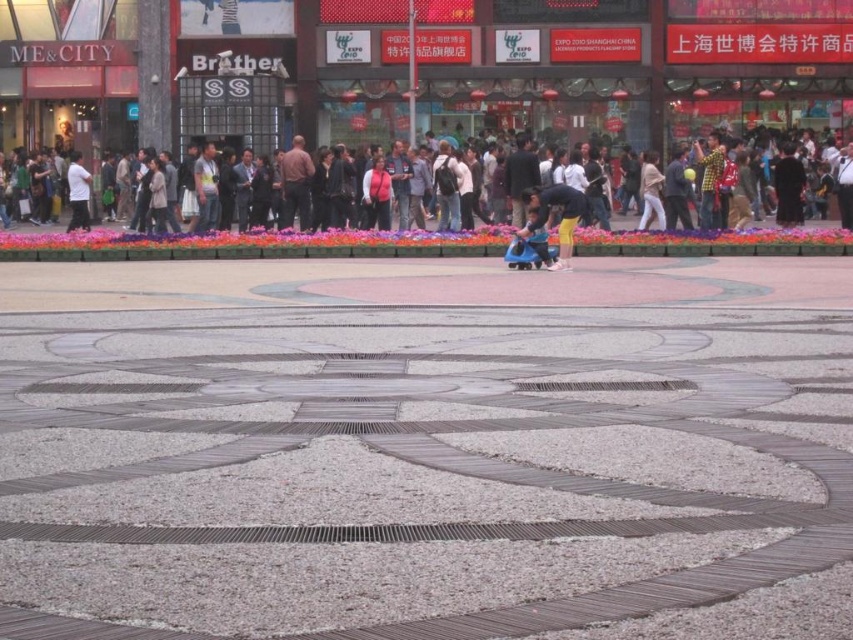
Question: Estimate the real-world distances between objects in this image. Which object is closer to the white matte shirt at left?

Choices:
 (A) matte glass mall at upper center
 (B) white gravel at center
 (C) black matte person at right
 (D) yellow fabric pants at center

Answer: (A)

Question: Where is white gravel at center located in relation to matte black jacket at center in the image?

Choices:
 (A) left
 (B) right

Answer: (B)

Question: Is white gravel at center thinner than yellow fabric pants at center?

Choices:
 (A) yes
 (B) no

Answer: (B)

Question: Considering the relative positions of white matte shirt at left and light beige sweater at center in the image provided, where is white matte shirt at left located with respect to light beige sweater at center?

Choices:
 (A) right
 (B) left

Answer: (B)

Question: Which object is closer to the camera taking this photo?

Choices:
 (A) light beige sweater at center
 (B) black matte person at right

Answer: (A)

Question: Which of the following is the farthest from the observer?

Choices:
 (A) (775, 216)
 (B) (78, 464)
 (C) (160, 180)
 (D) (506, 38)

Answer: (D)